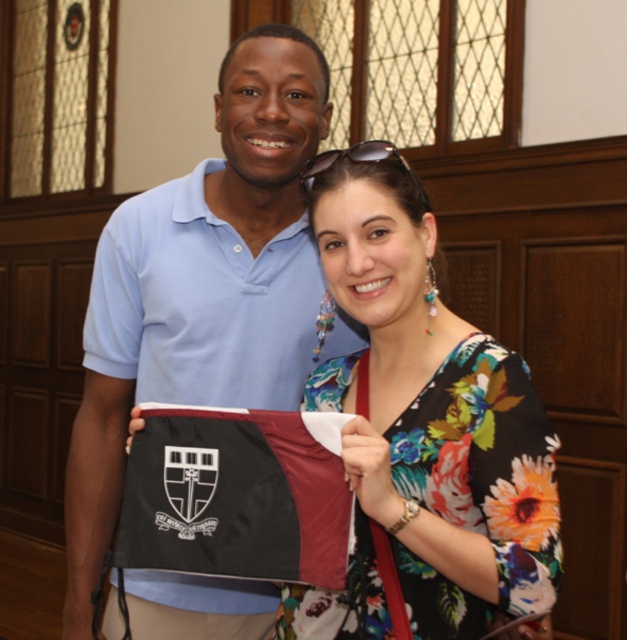
Question: Which of the following is the farthest from the observer?

Choices:
 (A) (325, 627)
 (B) (80, 545)

Answer: (B)

Question: Which object is the closest to the light blue cotton polo shirt at center?

Choices:
 (A) black fabric flag at center
 (B) floral fabric dress at center

Answer: (B)

Question: Considering the relative positions of light blue cotton polo shirt at center and floral fabric dress at center in the image provided, where is light blue cotton polo shirt at center located with respect to floral fabric dress at center?

Choices:
 (A) above
 (B) below

Answer: (A)

Question: Can you confirm if light blue cotton polo shirt at center is positioned above floral fabric dress at center?

Choices:
 (A) yes
 (B) no

Answer: (A)

Question: Observing the image, what is the correct spatial positioning of light blue cotton polo shirt at center in reference to black fabric flag at center?

Choices:
 (A) left
 (B) right

Answer: (A)

Question: Among these points, which one is nearest to the camera?

Choices:
 (A) (155, 250)
 (B) (332, 234)

Answer: (B)